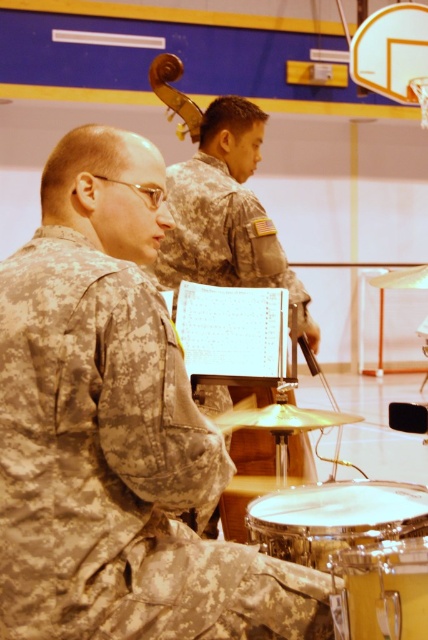
Does camouflage fabric uniform at left have a greater width compared to yellow drum at lower right?

Yes.

Is point (225, 228) closer to viewer compared to point (371, 573)?

That is False.

Between point (216, 509) and point (353, 600), which one is positioned behind?

Positioned behind is point (216, 509).

Identify the location of camouflage fabric uniform at left. (226, 212).

Between point (332, 508) and point (395, 557), which one is positioned behind?

The point (332, 508) is more distant.

Is point (392, 520) less distant than point (332, 557)?

No, (392, 520) is further to viewer.

You are a GUI agent. You are given a task and a screenshot of the screen. Output one action in this format:
    pyautogui.click(x=<x>, y=<y>)
    Task: Click on the shiny silver drum at center
    This screenshot has height=640, width=428.
    Given the screenshot: What is the action you would take?
    pyautogui.click(x=335, y=518)

Which is more to the left, camouflage fabric uniform at left or shiny silver drum at center?

Positioned to the left is camouflage fabric uniform at left.

Which is in front, point (256, 284) or point (330, 513)?

Point (330, 513) is more forward.

Is point (184, 177) more distant than point (318, 548)?

Yes, it is behind point (318, 548).

In order to click on camouflage fabric uniform at left in this screenshot , I will do [x=226, y=212].